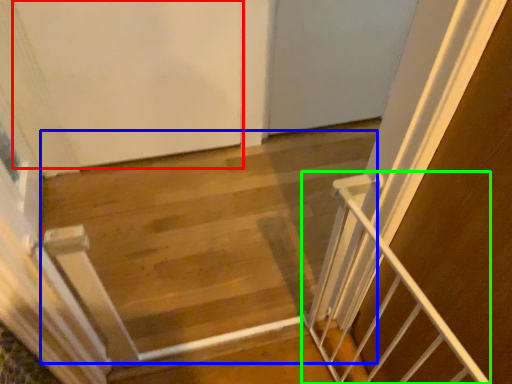
Question: Based on their relative distances, which object is nearer to door (highlighted by a red box)? Choose from stairwell (highlighted by a blue box) and stairs (highlighted by a green box).

Choices:
 (A) stairwell
 (B) stairs

Answer: (A)